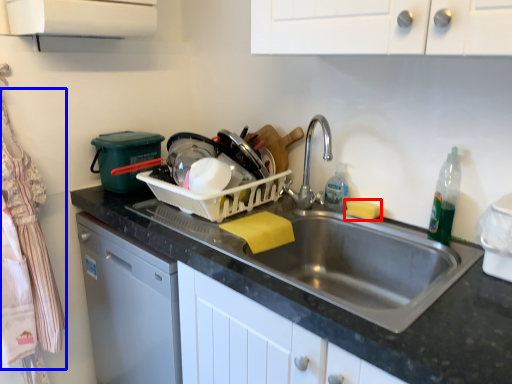
Question: Which object is closer to the camera taking this photo, food (highlighted by a red box) or laundry (highlighted by a blue box)?

Choices:
 (A) food
 (B) laundry

Answer: (B)